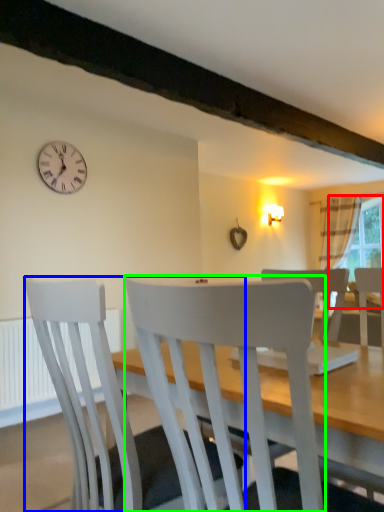
Question: Which object is the farthest from window screen (highlighted by a red box)? Choose among these: chair (highlighted by a blue box) or chair (highlighted by a green box).

Choices:
 (A) chair
 (B) chair

Answer: (B)